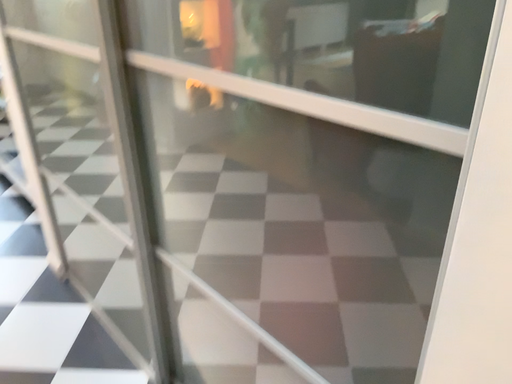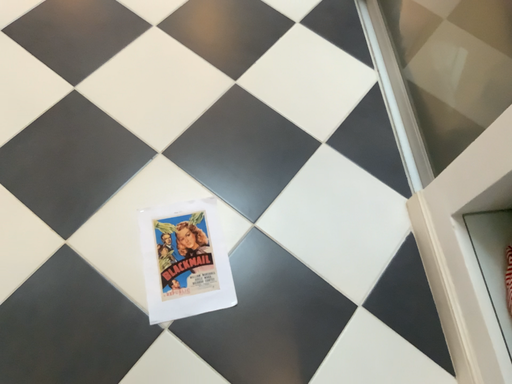
Question: How did the camera likely rotate when shooting the video?

Choices:
 (A) rotated right
 (B) rotated left

Answer: (B)